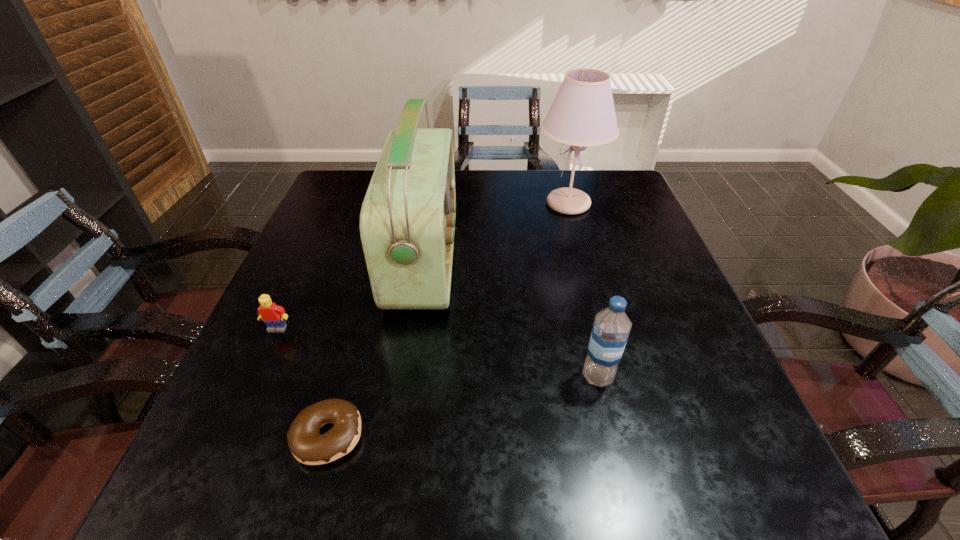
Find the location of a particular element. The image size is (960, 540). lampshade is located at coordinates (582, 114).

Image resolution: width=960 pixels, height=540 pixels. I want to click on radio receiver, so click(x=407, y=221).

At what (x,y) coordinates should I click in order to perform the action: click on water bottle. Please return your answer as a coordinate pair (x, y). Image resolution: width=960 pixels, height=540 pixels. Looking at the image, I should click on (611, 328).

The width and height of the screenshot is (960, 540). In order to click on the second nearest object in this screenshot , I will do [x=611, y=328].

Identify the location of Lego. This screenshot has height=540, width=960. (273, 315).

Locate an element on the screen. This screenshot has height=540, width=960. the fourth tallest object is located at coordinates (273, 315).

The height and width of the screenshot is (540, 960). I want to click on doughnut, so click(308, 446).

Where is `the shortest object`? The height and width of the screenshot is (540, 960). the shortest object is located at coordinates (308, 446).

Find the location of `free region located on the left of the lampshade`. free region located on the left of the lampshade is located at coordinates (493, 204).

Where is `free location located 0.260m on the front panel of the radio receiver`? This screenshot has width=960, height=540. free location located 0.260m on the front panel of the radio receiver is located at coordinates 568,260.